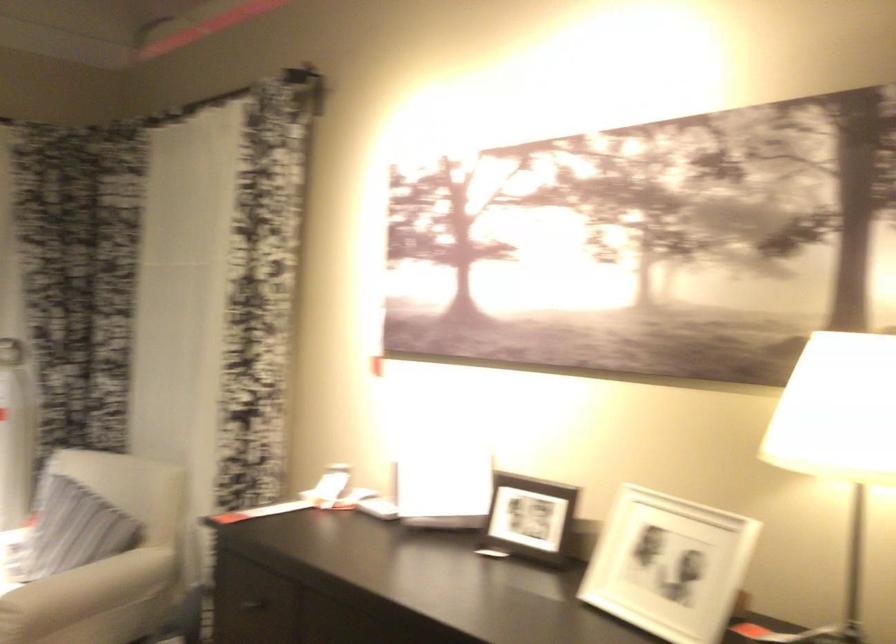
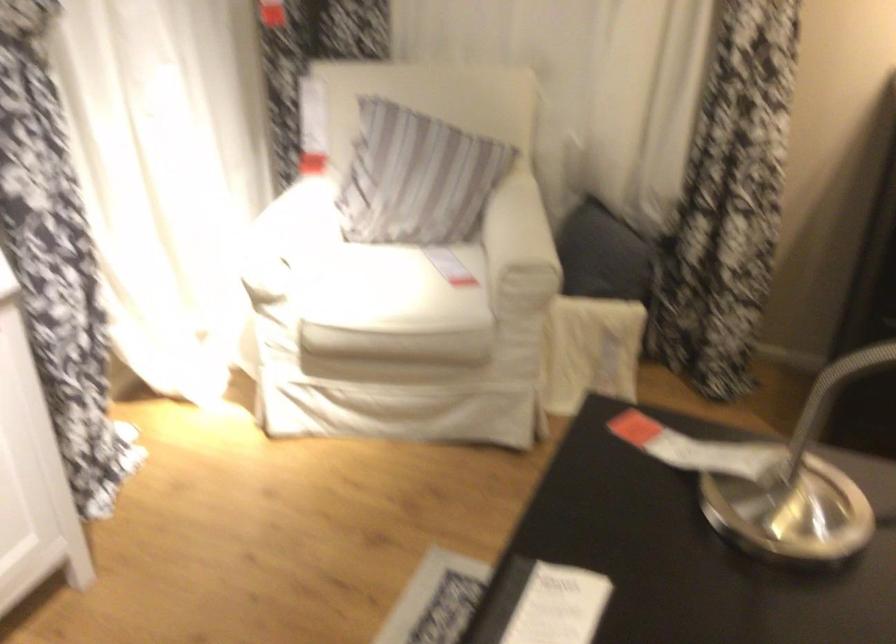
Find the pixel in the second image that matches point (72, 533) in the first image.

(416, 178)